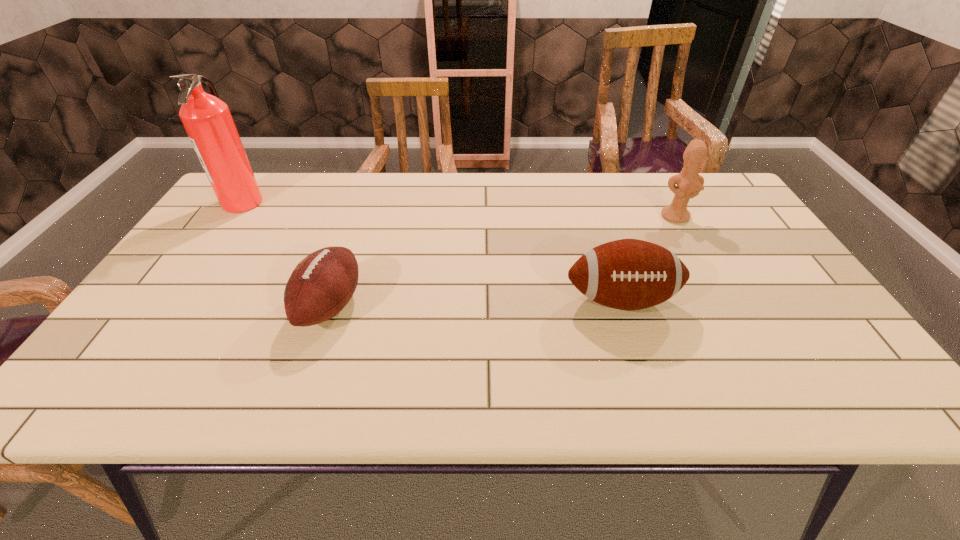
What are the coordinates of `vacant space in between the figurine and the leftmost object` in the screenshot? It's located at (459, 209).

Where is `vacant area between the second object from right to left and the tallest object`? vacant area between the second object from right to left and the tallest object is located at coordinates (432, 251).

Image resolution: width=960 pixels, height=540 pixels. What are the coordinates of `unoccupied position between the fire extinguisher and the second object from right to left` in the screenshot? It's located at (432, 251).

Identify the location of vacant area that lies between the third object from left to right and the fire extinguisher. (432, 251).

You are a GUI agent. You are given a task and a screenshot of the screen. Output one action in this format:
    pyautogui.click(x=<x>, y=<y>)
    Task: Click on the empty location between the rightmost object and the left football (American)
    The image size is (960, 540).
    Given the screenshot: What is the action you would take?
    pyautogui.click(x=503, y=261)

At what (x,y) coordinates should I click in order to perform the action: click on vacant space in between the left football (American) and the second object from right to left. Please return your answer as a coordinate pair (x, y). This screenshot has width=960, height=540. Looking at the image, I should click on (475, 303).

Identify the location of vacant region between the tallest object and the figurine. Image resolution: width=960 pixels, height=540 pixels. (459, 209).

Identify the location of object that is the second closest one to the left football (American). (628, 274).

Identify which object is the closest to the shortest object. Please provide its 2D coordinates. Your answer should be formatted as a tuple, i.e. [(x, y)], where the tuple contains the x and y coordinates of a point satisfying the conditions above.

[(207, 120)]

Where is `blank space that satisfies the following two spatial constraints: 1. at the nozzle of the leftmost object; 2. on the right side of the left football (American)`? The width and height of the screenshot is (960, 540). blank space that satisfies the following two spatial constraints: 1. at the nozzle of the leftmost object; 2. on the right side of the left football (American) is located at coordinates (170, 306).